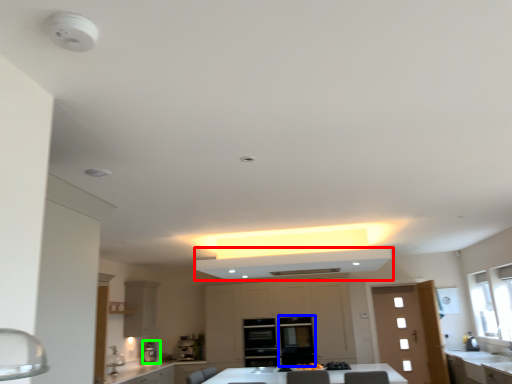
Question: Considering the real-world distances, which object is farthest from exhaust hood (highlighted by a red box)? glass door (highlighted by a blue box) or coffee machine (highlighted by a green box)?

Choices:
 (A) glass door
 (B) coffee machine

Answer: (B)